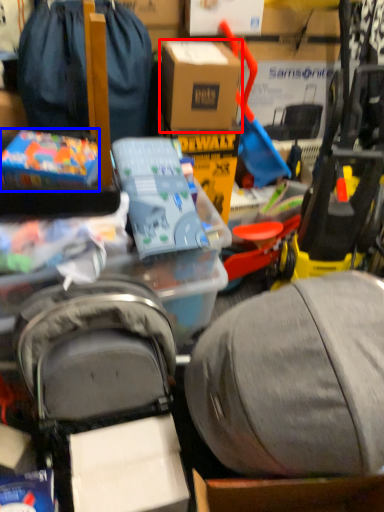
Question: Which point is closer to the camera, box (highlighted by a red box) or toy (highlighted by a blue box)?

Choices:
 (A) box
 (B) toy

Answer: (B)